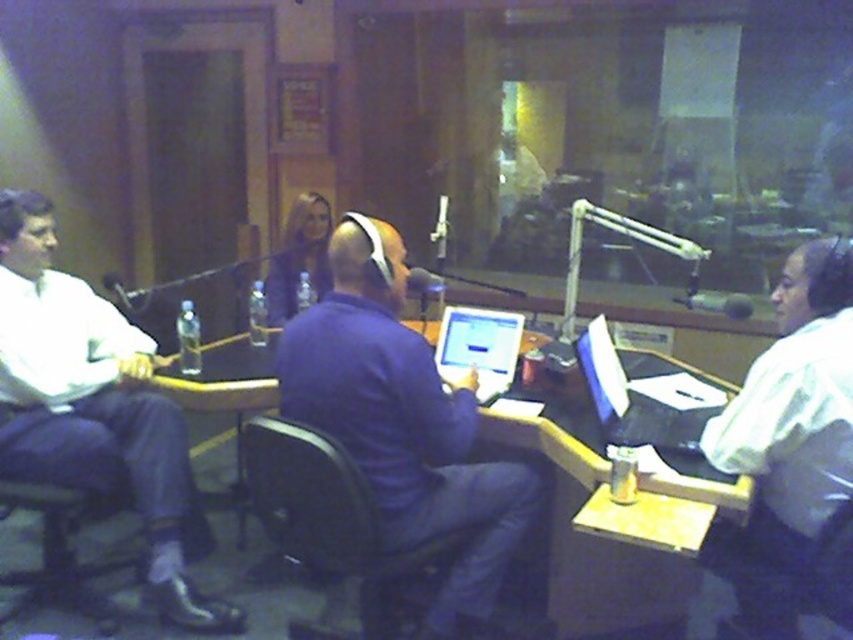
You are a guest speaker who just arrived and needs to sit down at the table. There is a white shirt at left and a matte silver laptop at center. Which object should you avoid placing your bag on to ensure it doesn

You should avoid placing your bag on the matte silver laptop at center because the white shirt at left is positioned on the left side of it, meaning the laptop is in the center and likely part of the workspace. Placing a bag there could obstruct the laptop or interfere with the ongoing session.

You are a guest entering the studio and need to sit down. There is a chair available near the white shirt at left and another near the matte silver laptop at center. Which chair should you choose to be closer to the front of the studio?

You should choose the chair near the white shirt at left because it is closer to the front of the studio since the white shirt at left is further to the viewer than the matte silver laptop at center.